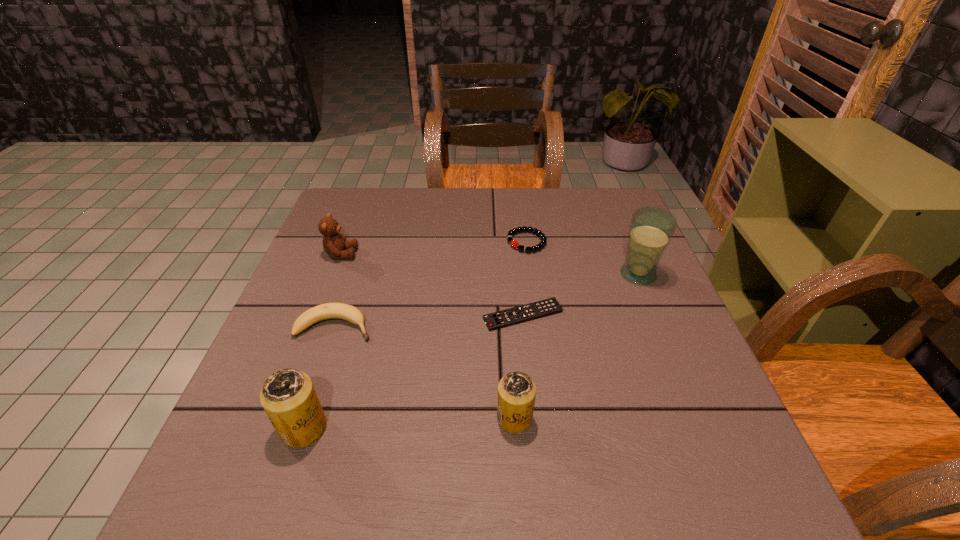
Locate an element on the screen. The height and width of the screenshot is (540, 960). vacant space that is in between the teddy bear and the shortest object is located at coordinates point(432,285).

The height and width of the screenshot is (540, 960). I want to click on vacant space that's between the teddy bear and the rightmost object, so click(490, 264).

You are a GUI agent. You are given a task and a screenshot of the screen. Output one action in this format:
    pyautogui.click(x=<x>, y=<y>)
    Task: Click on the empty space that is in between the shorter beer can and the rightmost object
    The width and height of the screenshot is (960, 540).
    Given the screenshot: What is the action you would take?
    click(x=576, y=346)

Locate an element on the screen. blank region between the glass and the shortest object is located at coordinates (581, 295).

Identify the location of vacant space that's between the tallest object and the teddy bear. (490, 264).

At what (x,y) coordinates should I click in order to perform the action: click on unoccupied area between the second shortest object and the rightmost object. Please return your answer as a coordinate pair (x, y). Looking at the image, I should click on (583, 258).

Image resolution: width=960 pixels, height=540 pixels. I want to click on free area in between the glass and the shorter beer can, so click(576, 346).

Identify which object is the fifth closest to the fifth tallest object. Please provide its 2D coordinates. Your answer should be formatted as a tuple, i.e. [(x, y)], where the tuple contains the x and y coordinates of a point satisfying the conditions above.

[(513, 243)]

The height and width of the screenshot is (540, 960). What are the coordinates of `object that is the second nearest to the rightmost object` in the screenshot? It's located at (513, 243).

The width and height of the screenshot is (960, 540). In order to click on vacant region that satisfies the following two spatial constraints: 1. on the face of the shortest object; 2. on the right side of the teddy bear in this screenshot , I will do `click(318, 315)`.